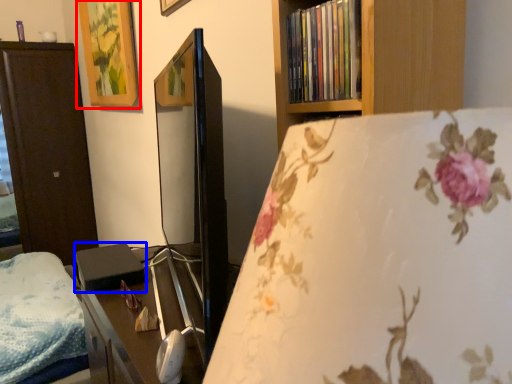
Question: Which object appears closest to the camera in this image, picture frame (highlighted by a red box) or paperback book (highlighted by a blue box)?

Choices:
 (A) picture frame
 (B) paperback book

Answer: (B)